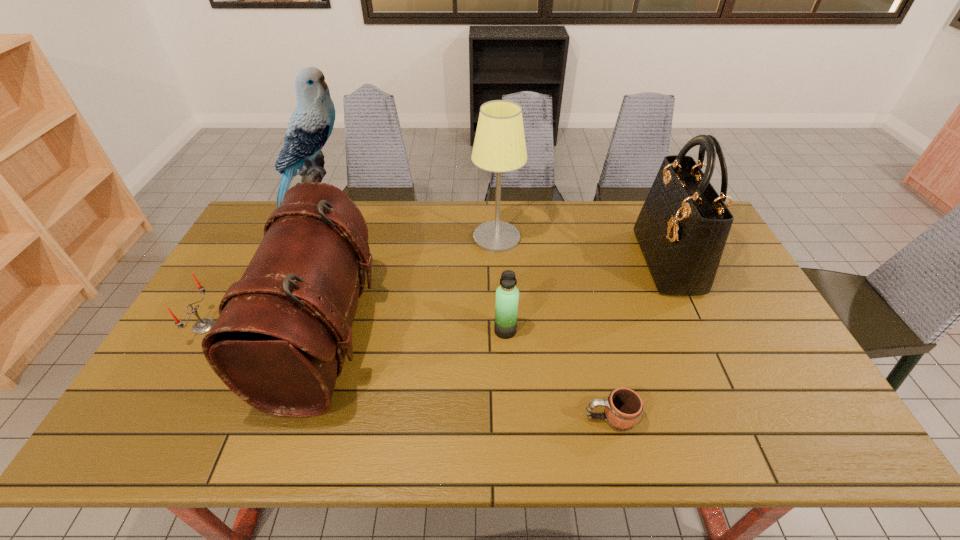
This screenshot has width=960, height=540. I want to click on parakeet, so click(x=311, y=124).

Where is `table lamp`? The width and height of the screenshot is (960, 540). table lamp is located at coordinates (499, 146).

Where is `handbag`? This screenshot has width=960, height=540. handbag is located at coordinates (682, 228).

You are a GUI agent. You are given a task and a screenshot of the screen. Output one action in this format:
    pyautogui.click(x=<x>, y=<y>)
    Task: Click on the fourth shortest object
    The image size is (960, 540).
    Given the screenshot: What is the action you would take?
    pyautogui.click(x=284, y=329)

What are the coordinates of `the third shortest object` in the screenshot? It's located at (507, 295).

At what (x,y) coordinates should I click in order to perform the action: click on the leftmost object. Please return your answer as a coordinate pair (x, y). The image size is (960, 540). Looking at the image, I should click on (204, 325).

Find the location of a particular element. The image size is (960, 540). the sixth tallest object is located at coordinates (204, 325).

This screenshot has height=540, width=960. Find the location of `the sixth object from left to right`. the sixth object from left to right is located at coordinates pos(623,408).

Find the location of `mug`. mug is located at coordinates (623, 408).

Find the location of a particular element. Image resolution: width=960 pixels, height=540 pixels. free space located 0.070m on the face of the parakeet is located at coordinates (376, 220).